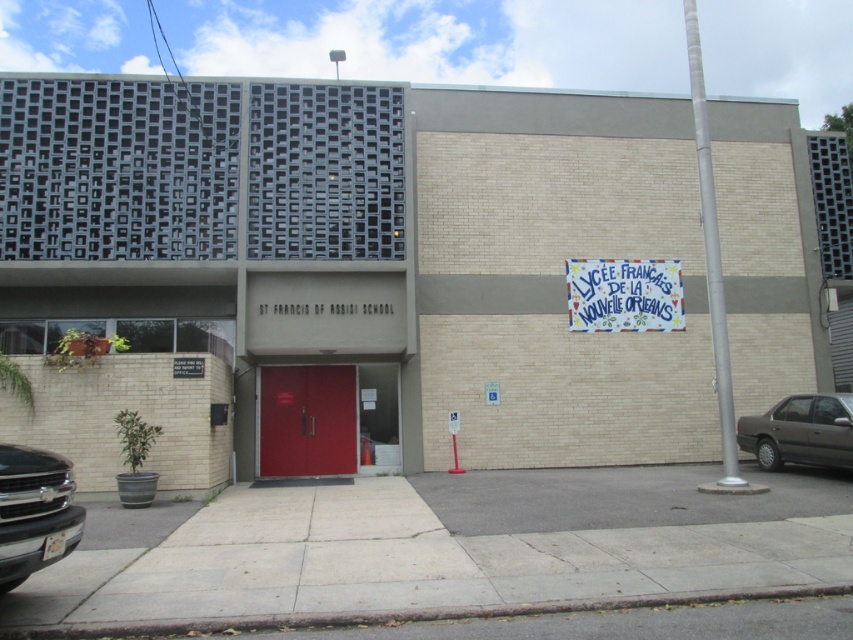
Question: Which of the following is the farthest from the observer?

Choices:
 (A) (39, 566)
 (B) (270, 472)

Answer: (B)

Question: Does matte red door at center have a larger size compared to dark gray metallic sedan at lower right?

Choices:
 (A) no
 (B) yes

Answer: (A)

Question: Is matte red door at center bigger than dark gray metallic sedan at lower right?

Choices:
 (A) no
 (B) yes

Answer: (A)

Question: Which object appears closest to the camera in this image?

Choices:
 (A) matte red door at center
 (B) dark gray metallic sedan at lower right
 (C) black glossy truck at lower left

Answer: (C)

Question: Which of the following is the farthest from the observer?

Choices:
 (A) black glossy truck at lower left
 (B) matte red door at center

Answer: (B)

Question: Observing the image, what is the correct spatial positioning of matte red door at center in reference to dark gray metallic sedan at lower right?

Choices:
 (A) right
 (B) left

Answer: (B)